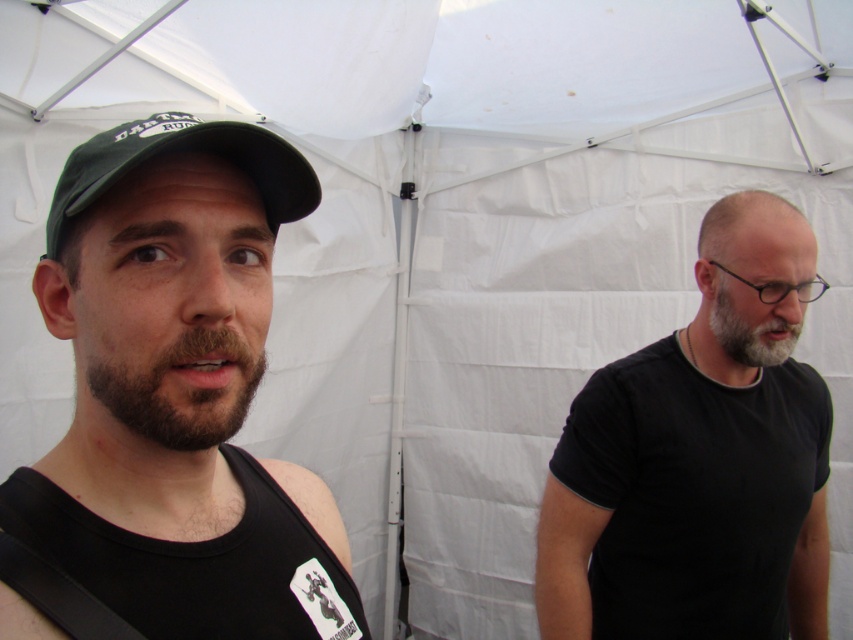
Question: Which of the following is the farthest from the observer?

Choices:
 (A) (627, 406)
 (B) (229, 420)
 (C) (296, 189)

Answer: (A)

Question: Can you confirm if dark brown fuzzy beard at left is thinner than gray matte beard at center?

Choices:
 (A) yes
 (B) no

Answer: (B)

Question: Which point is farther from the camera taking this photo?

Choices:
 (A) (669, 468)
 (B) (114, 570)
 (C) (137, 205)

Answer: (A)

Question: Is black matte cap at upper left to the left of dark brown fuzzy beard at left from the viewer's perspective?

Choices:
 (A) yes
 (B) no

Answer: (A)

Question: Estimate the real-world distances between objects in this image. Which object is closer to the dark brown fuzzy beard at left?

Choices:
 (A) black matte vest at center
 (B) green fabric cap at upper left
 (C) gray matte beard at center
 (D) black matte t-shirt at right

Answer: (B)

Question: Does black matte t-shirt at right have a larger size compared to dark brown fuzzy beard at left?

Choices:
 (A) yes
 (B) no

Answer: (A)